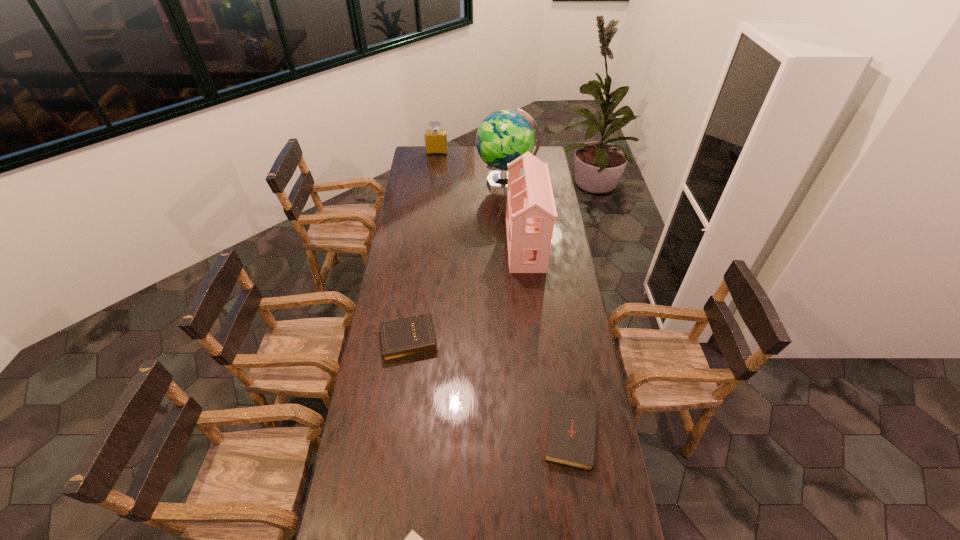
Identify the location of the fifth nearest object. (504, 135).

Locate an element on the screen. Image resolution: width=960 pixels, height=540 pixels. the third farthest object is located at coordinates (531, 211).

Locate an element on the screen. Image resolution: width=960 pixels, height=540 pixels. perfume is located at coordinates (435, 139).

This screenshot has height=540, width=960. What are the coordinates of `the fourth shortest object` in the screenshot? It's located at (435, 139).

In order to click on the fourth farthest object in this screenshot , I will do `click(403, 338)`.

Locate an element on the screen. The height and width of the screenshot is (540, 960). the second tallest Bible is located at coordinates 572,432.

The height and width of the screenshot is (540, 960). What are the coordinates of `the rightmost Bible` in the screenshot? It's located at (572, 432).

The image size is (960, 540). In order to click on free spot located on the front surface of the second farthest object in this screenshot , I will do `click(428, 182)`.

Where is `vacant space positioned 0.350m on the front surface of the second farthest object`? vacant space positioned 0.350m on the front surface of the second farthest object is located at coordinates (417, 182).

Where is `vacant region located 0.150m on the front surface of the second farthest object`? The width and height of the screenshot is (960, 540). vacant region located 0.150m on the front surface of the second farthest object is located at coordinates pyautogui.click(x=450, y=182).